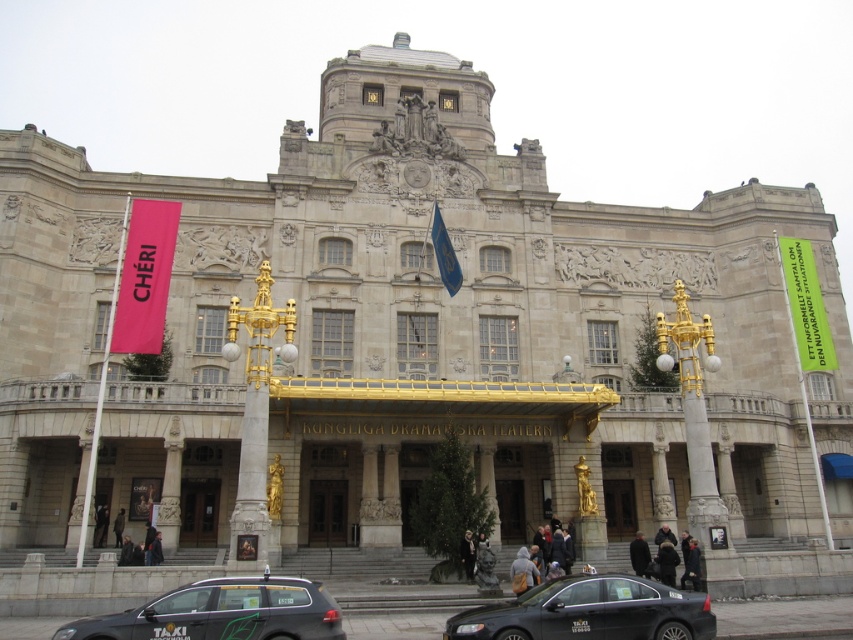
Question: Is pink fabric banner at left smaller than brown wooden door at center?

Choices:
 (A) yes
 (B) no

Answer: (B)

Question: Which point is closer to the camera?

Choices:
 (A) blue fabric flag at center
 (B) black metallic taxi at lower center
 (C) black glossy taxi cab at lower center

Answer: (B)

Question: Does brown wooden door at center appear on the left side of blue fabric flag at center?

Choices:
 (A) yes
 (B) no

Answer: (A)

Question: Which object appears farthest from the camera in this image?

Choices:
 (A) green fabric banner at right
 (B) blue fabric flag at center
 (C) brown wooden door at center

Answer: (A)

Question: Can you confirm if black glossy taxi cab at lower center is positioned to the left of black metallic taxi at lower center?

Choices:
 (A) yes
 (B) no

Answer: (B)

Question: Which of the following is the farthest from the observer?

Choices:
 (A) (457, 620)
 (B) (277, 592)
 (C) (141, 262)

Answer: (C)